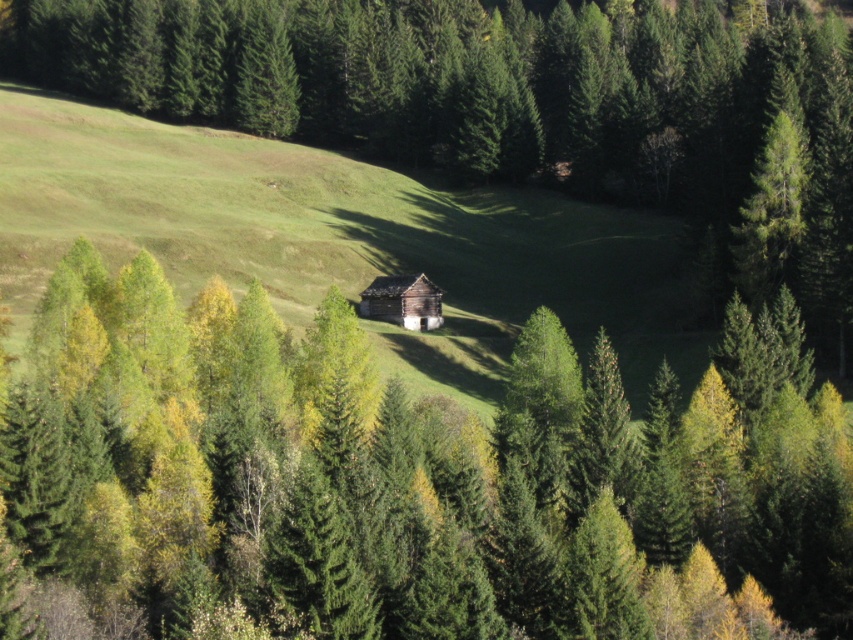
Does point (241, 426) come behind point (422, 312)?

No, (241, 426) is in front of (422, 312).

The image size is (853, 640). Describe the element at coordinates (410, 477) in the screenshot. I see `green matte tree at center` at that location.

This screenshot has height=640, width=853. I want to click on green matte tree at center, so click(410, 477).